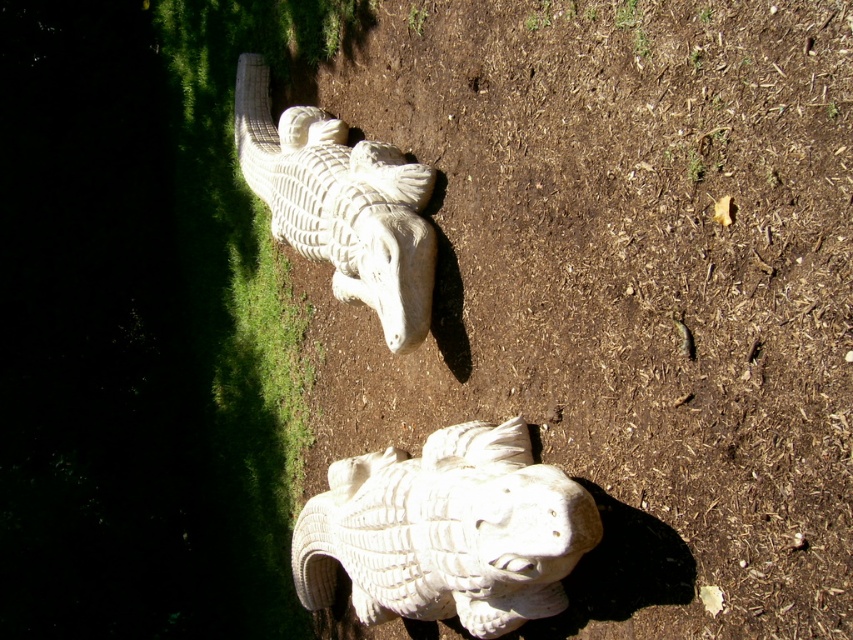
Question: Which point is farther to the camera?

Choices:
 (A) white stone crocodile at upper center
 (B) white stone fish at lower center

Answer: (A)

Question: Where is white stone fish at lower center located in relation to white stone crocodile at upper center in the image?

Choices:
 (A) above
 (B) below

Answer: (B)

Question: Is white stone fish at lower center to the right of white stone crocodile at upper center from the viewer's perspective?

Choices:
 (A) no
 (B) yes

Answer: (B)

Question: Does white stone fish at lower center appear on the left side of white stone crocodile at upper center?

Choices:
 (A) yes
 (B) no

Answer: (B)

Question: Which object is farther from the camera taking this photo?

Choices:
 (A) white stone crocodile at upper center
 (B) white stone fish at lower center

Answer: (A)

Question: Which object is closer to the camera taking this photo?

Choices:
 (A) white stone fish at lower center
 (B) white stone crocodile at upper center

Answer: (A)